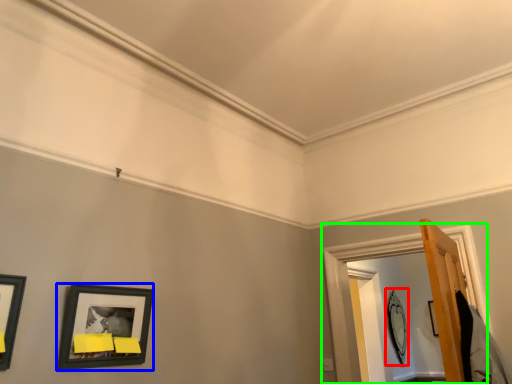
Question: Considering the real-world distances, which object is farthest from picture frame (highlighted by a red box)? picture frame (highlighted by a blue box) or window frame (highlighted by a green box)?

Choices:
 (A) picture frame
 (B) window frame

Answer: (A)